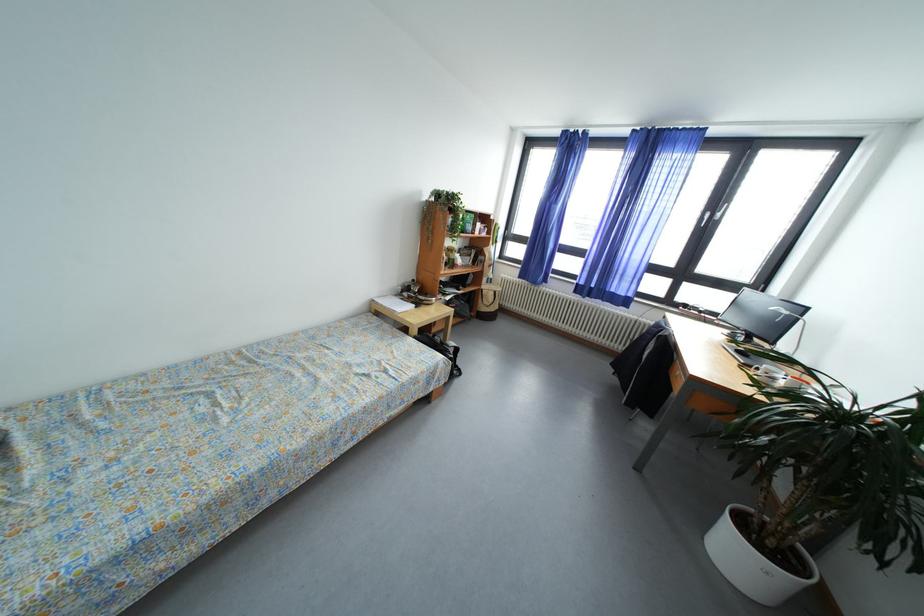
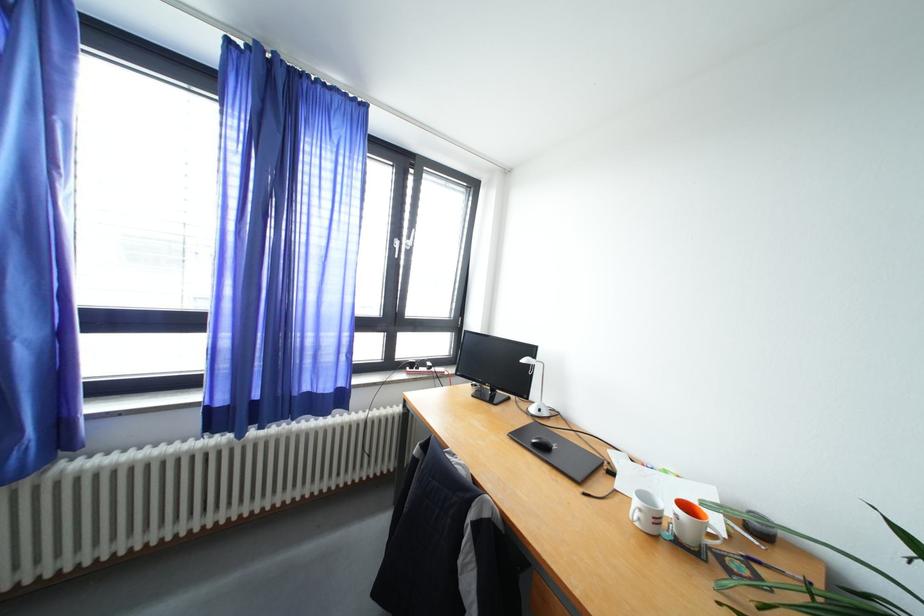
In the second image, find the point that corresponds to pixel 691 310 in the first image.

(419, 370)